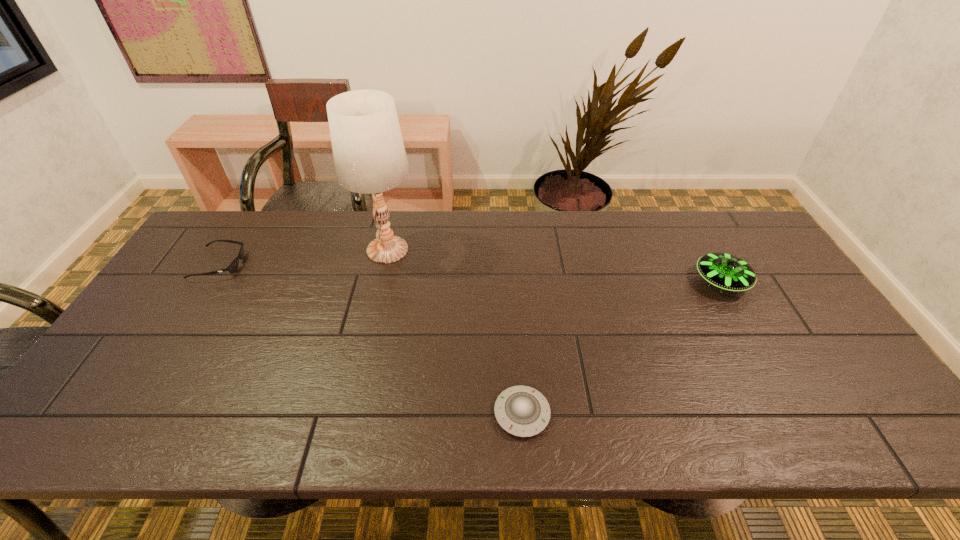
Identify the location of the second object from left to right. The width and height of the screenshot is (960, 540). 369,155.

Where is `lamp`? The height and width of the screenshot is (540, 960). lamp is located at coordinates (369, 155).

Identify the location of the third shortest object. Image resolution: width=960 pixels, height=540 pixels. (728, 272).

Locate an element on the screen. This screenshot has height=540, width=960. the farther saucer is located at coordinates (728, 272).

You are a GUI agent. You are given a task and a screenshot of the screen. Output one action in this format:
    pyautogui.click(x=<x>, y=<y>)
    Task: Click on the sunglasses
    This screenshot has height=540, width=960.
    Given the screenshot: What is the action you would take?
    pyautogui.click(x=233, y=266)

Identify the location of the second shortest object. The height and width of the screenshot is (540, 960). (233, 266).

Where is `the shortest object`? The width and height of the screenshot is (960, 540). the shortest object is located at coordinates (522, 411).

At what (x,y) coordinates should I click in order to perform the action: click on the third object from left to right. Please return your answer as a coordinate pair (x, y). Looking at the image, I should click on (522, 411).

Image resolution: width=960 pixels, height=540 pixels. In order to click on vacant space situated on the right of the lamp in this screenshot , I will do `click(456, 250)`.

In order to click on vacant space located on the front of the taller saucer in this screenshot , I will do `click(756, 343)`.